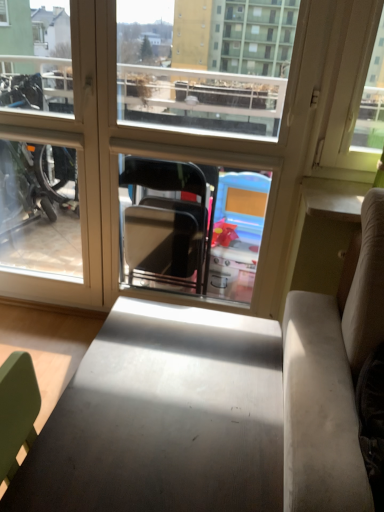
Question: Can you confirm if transparent glass window at center is positioned to the left of matte gray table at center?

Choices:
 (A) no
 (B) yes

Answer: (B)

Question: Is transparent glass window at center not inside matte gray table at center?

Choices:
 (A) yes
 (B) no

Answer: (A)

Question: From a real-world perspective, is transparent glass window at center physically above matte gray table at center?

Choices:
 (A) yes
 (B) no

Answer: (A)

Question: Is the depth of transparent glass window at center less than that of matte gray table at center?

Choices:
 (A) yes
 (B) no

Answer: (B)

Question: Is transparent glass window at center further to the viewer compared to matte gray table at center?

Choices:
 (A) no
 (B) yes

Answer: (B)

Question: Can you confirm if transparent glass window at center is shorter than matte gray table at center?

Choices:
 (A) no
 (B) yes

Answer: (A)

Question: Is matte gray table at center outside of transparent glass window at center?

Choices:
 (A) no
 (B) yes

Answer: (B)

Question: Is the depth of matte gray table at center greater than that of transparent glass window at center?

Choices:
 (A) no
 (B) yes

Answer: (A)

Question: Considering the relative sizes of matte gray table at center and transparent glass window at center in the image provided, is matte gray table at center taller than transparent glass window at center?

Choices:
 (A) no
 (B) yes

Answer: (A)

Question: Does matte gray table at center appear on the right side of transparent glass window at center?

Choices:
 (A) no
 (B) yes

Answer: (B)

Question: Considering the relative sizes of matte gray table at center and transparent glass window at center in the image provided, is matte gray table at center thinner than transparent glass window at center?

Choices:
 (A) no
 (B) yes

Answer: (A)

Question: From a real-world perspective, is matte gray table at center below transparent glass window at center?

Choices:
 (A) no
 (B) yes

Answer: (B)

Question: Considering the relative positions of matte gray table at center and transparent glass window at center in the image provided, is matte gray table at center to the left or to the right of transparent glass window at center?

Choices:
 (A) left
 (B) right

Answer: (B)